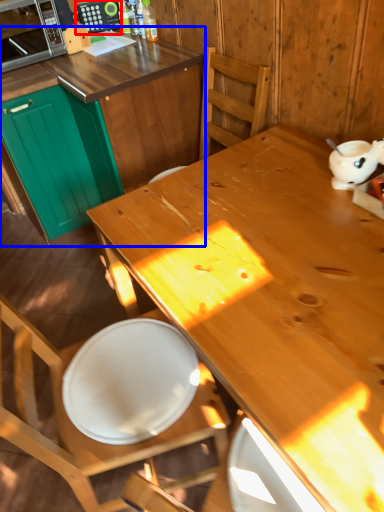
Question: Which object appears closest to the camera in this image, appliance (highlighted by a red box) or cabinetry (highlighted by a blue box)?

Choices:
 (A) appliance
 (B) cabinetry

Answer: (B)